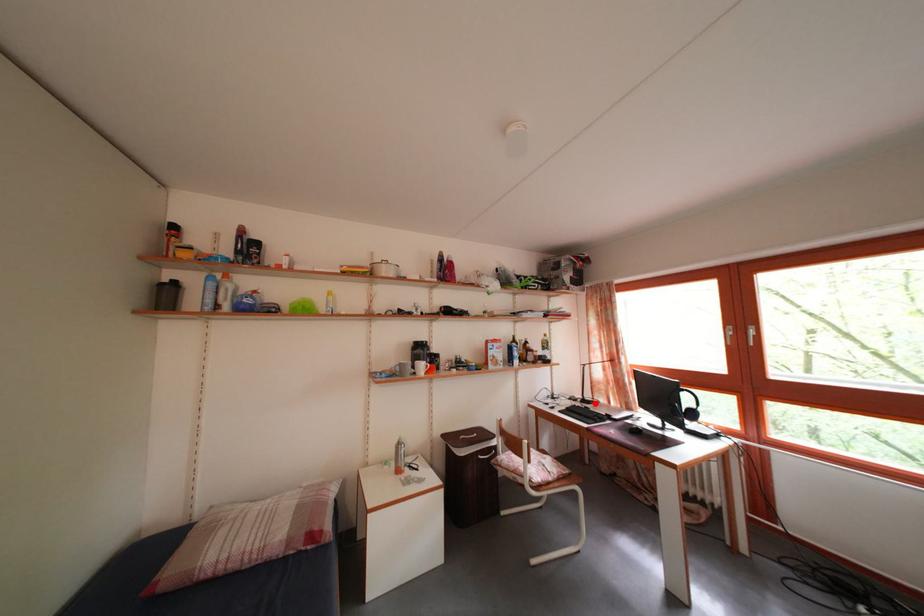
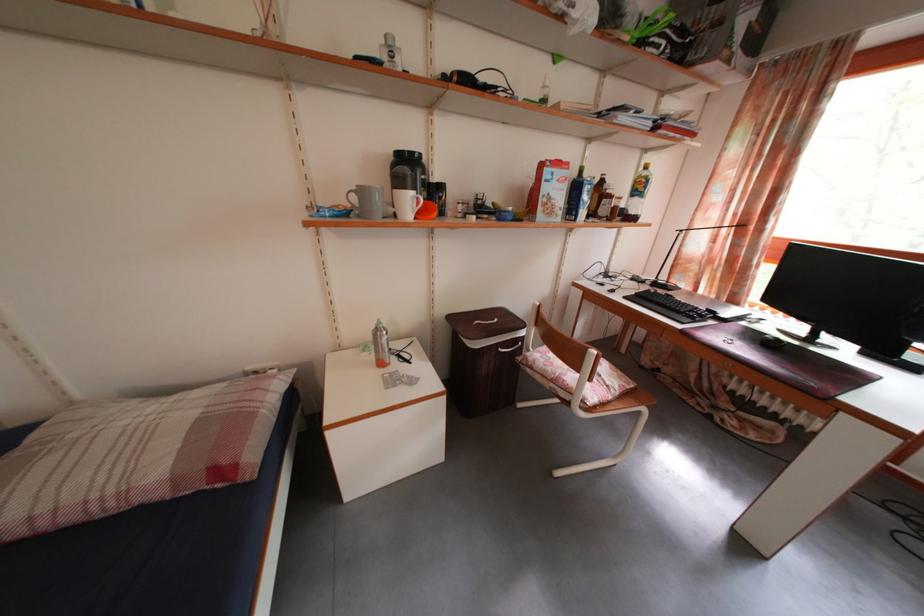
Question: I am providing you with two images of the same scene from different viewpoints. A red point is marked on the first image. At the location where the point appears in image 1, is it still visible in image 2?

Choices:
 (A) Yes
 (B) No

Answer: (A)